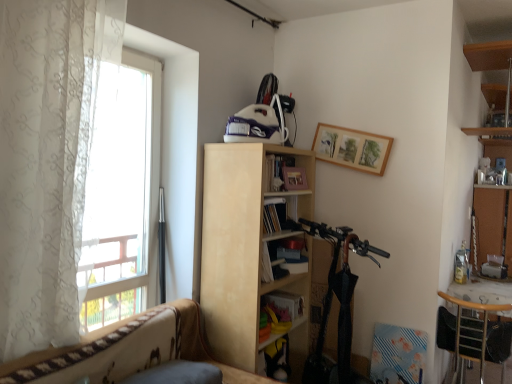
Question: Considering the positions of wooden chair at lower right and matte yellow book at center, placed as the second book when sorted from top to bottom, in the image, is wooden chair at lower right wider or thinner than matte yellow book at center, placed as the second book when sorted from top to bottom,?

Choices:
 (A) thin
 (B) wide

Answer: (B)

Question: Is point (448, 299) closer or farther from the camera than point (286, 296)?

Choices:
 (A) closer
 (B) farther

Answer: (A)

Question: Estimate the real-world distances between objects in this image. Which object is closer to the matte yellow book at center, positioned as the first book in bottom-to-top order?

Choices:
 (A) wooden chair at lower right
 (B) wooden picture frame at upper center
 (C) white sheer curtain at left
 (D) light wood bookcase at center
 (E) patterned fabric couch at lower left

Answer: (D)

Question: Which object is positioned farthest from the wooden chair at lower right?

Choices:
 (A) hardcover book at center, which is the second book from bottom to top
 (B) matte yellow book at center, placed as the second book when sorted from top to bottom
 (C) wooden picture frame at upper center
 (D) light wood bookcase at center
 (E) bare wood cabinet at right

Answer: (D)